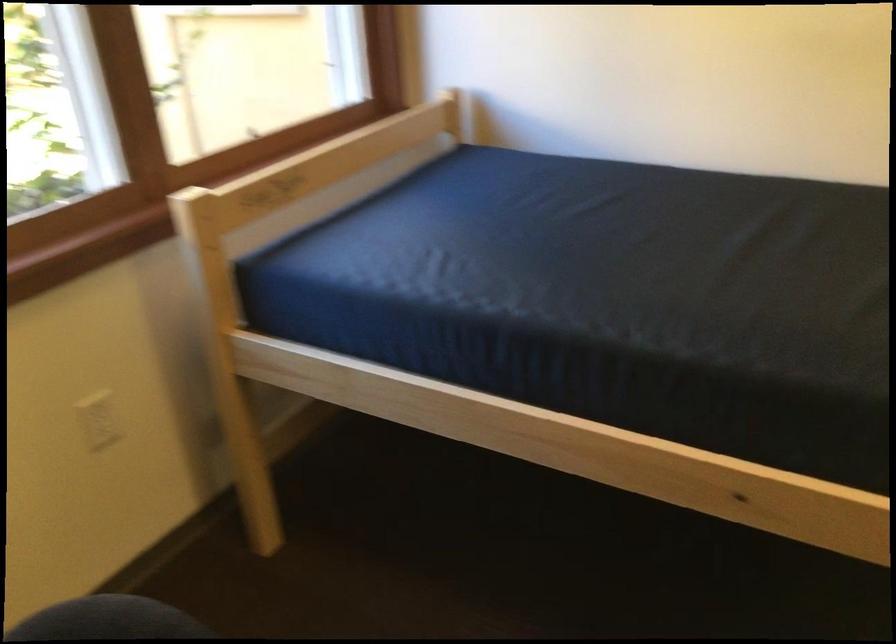
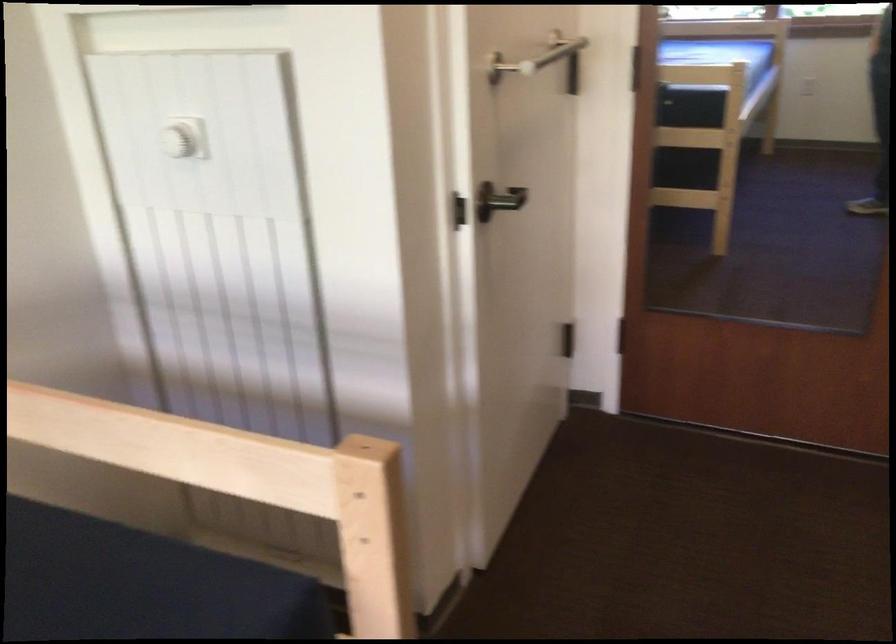
First-person continuous shooting, in which direction is the camera rotating?

The rotation direction of the camera is right-down.